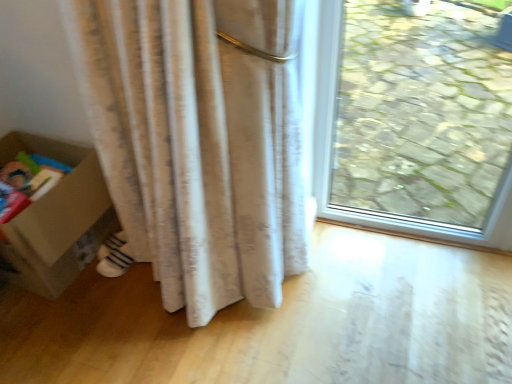
Question: In terms of width, does white striped socks at lower left look wider or thinner when compared to cardboard box at lower left?

Choices:
 (A) wide
 (B) thin

Answer: (B)

Question: Is point [x=117, y=251] closer or farther from the camera than point [x=59, y=292]?

Choices:
 (A) farther
 (B) closer

Answer: (A)

Question: Which is correct: white striped socks at lower left is inside cardboard box at lower left, or outside of it?

Choices:
 (A) outside
 (B) inside

Answer: (A)

Question: From the image's perspective, is cardboard box at lower left located above or below white striped socks at lower left?

Choices:
 (A) above
 (B) below

Answer: (A)

Question: Relative to white striped socks at lower left, is cardboard box at lower left in front or behind?

Choices:
 (A) behind
 (B) front

Answer: (B)

Question: Is cardboard box at lower left taller or shorter than white striped socks at lower left?

Choices:
 (A) short
 (B) tall

Answer: (B)

Question: Looking at their shapes, would you say cardboard box at lower left is wider or thinner than white striped socks at lower left?

Choices:
 (A) thin
 (B) wide

Answer: (B)